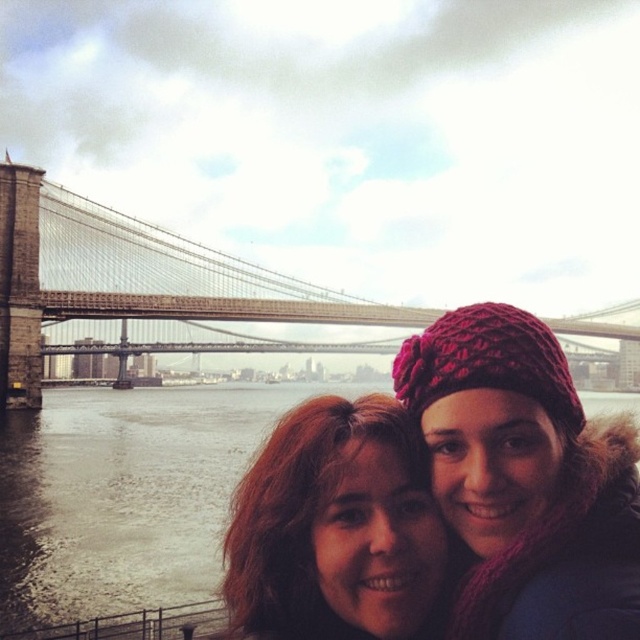
From the picture: You are a photographer trying to capture a clear shot of both the knitted wool hat at center and the matte red knit hat at center in the foreground. Since the bridge is in the background, you need to ensure both hats are in focus. Which hat should you focus on first to ensure proper depth of field?

You should focus on the knitted wool hat at center first because it is taller than the matte red knit hat at center, so focusing on the taller hat will help ensure both are in focus.

Based on the photo, you are a photographer trying to capture a clear shot of the knitted wool hat at center and the stone bridge at center in the background. Given their sizes, which object should you focus on first to ensure both are in focus?

The stone bridge at center is larger than the knitted wool hat at center, so focusing on the stone bridge at center first will help ensure both are in focus since it occupies more of the frame.